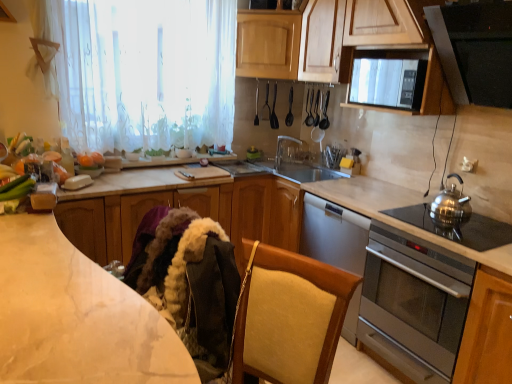
You are a GUI agent. You are given a task and a screenshot of the screen. Output one action in this format:
    pyautogui.click(x=<x>, y=<y>)
    Task: Click on the free space in front of clear plastic tap at center
    The image size is (512, 384).
    Given the screenshot: What is the action you would take?
    tap(292, 177)